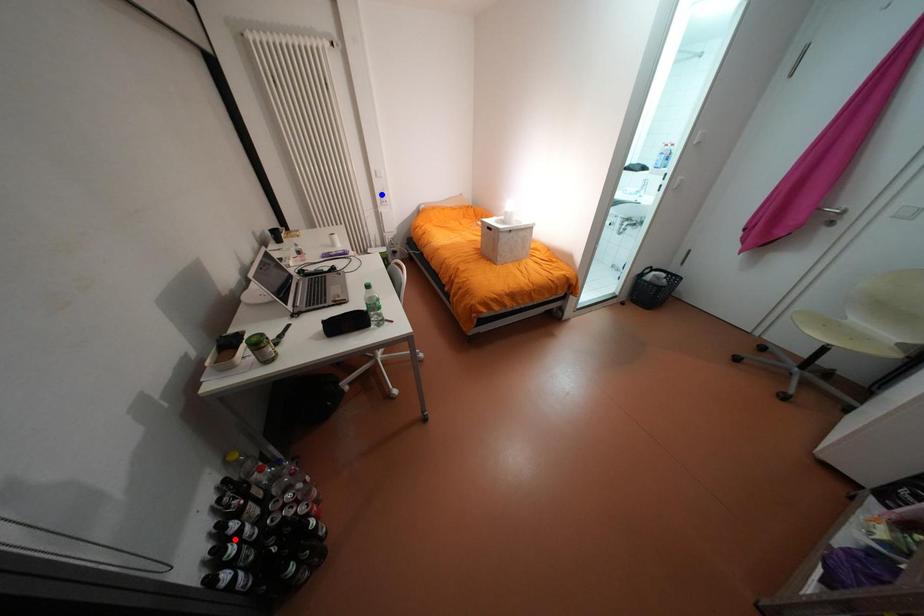
Question: Which of the two points in the image is closer to the camera?

Choices:
 (A) Blue point is closer.
 (B) Red point is closer.

Answer: (B)